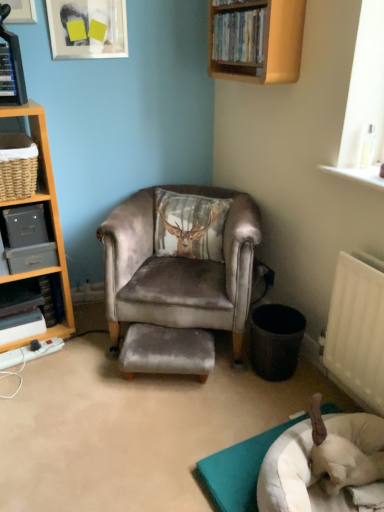
This screenshot has height=512, width=384. In order to click on vacant region to the right of hardcover book at left, placed as the 2th book when sorted from front to back in this screenshot , I will do `click(86, 316)`.